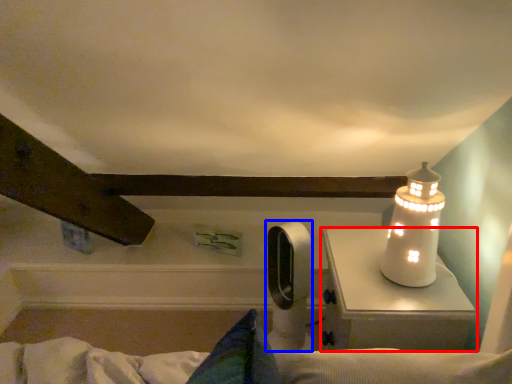
Question: Which object is further to the camera taking this photo, table (highlighted by a red box) or equipment (highlighted by a blue box)?

Choices:
 (A) table
 (B) equipment

Answer: (B)